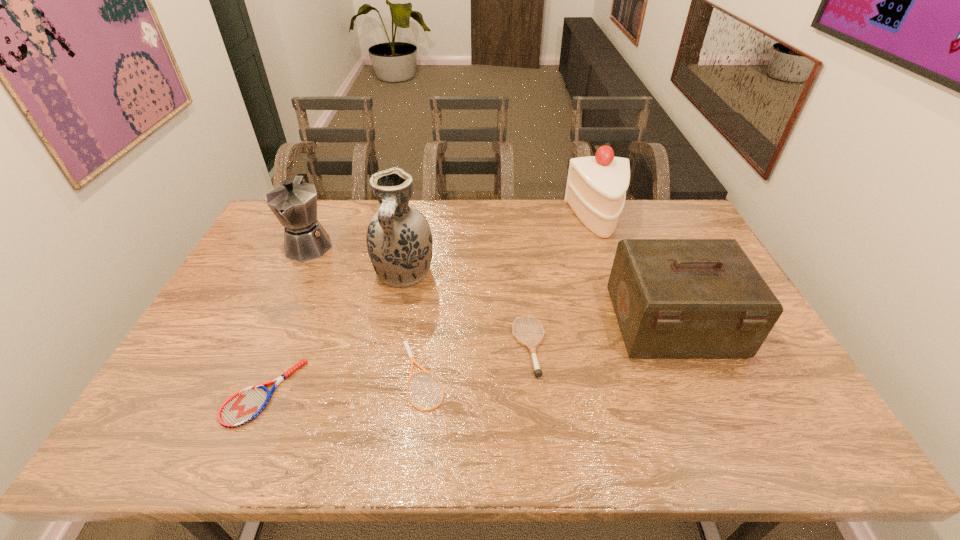
You are a GUI agent. You are given a task and a screenshot of the screen. Output one action in this format:
    pyautogui.click(x=<x>, y=<y>)
    Task: Click on the object present at the right edge
    Image resolution: width=960 pixels, height=540 pixels.
    Given the screenshot: What is the action you would take?
    pyautogui.click(x=673, y=298)

Find the location of `object situated at the far left corner`. object situated at the far left corner is located at coordinates (294, 203).

Find the location of a particular element. This screenshot has height=540, width=960. vacant position at the near edge of the desktop is located at coordinates (323, 440).

In the image, there is a desktop. Identify the location of vacant region at the left edge. (268, 304).

In the image, there is a desktop. In order to click on blank space at the right edge in this screenshot , I will do `click(785, 417)`.

Locate an element on the screen. free space at the near left corner of the desktop is located at coordinates (188, 423).

Identify the location of blank space at the far right corner of the desktop. (679, 212).

The width and height of the screenshot is (960, 540). What are the coordinates of `vacant point located between the tallest object and the rightmost tennis racket` in the screenshot? It's located at (467, 310).

Identify the location of free space between the first-aid kit and the coffeepot. The width and height of the screenshot is (960, 540). [492, 284].

Where is `free space between the vase and the cake`? This screenshot has width=960, height=540. free space between the vase and the cake is located at coordinates (501, 246).